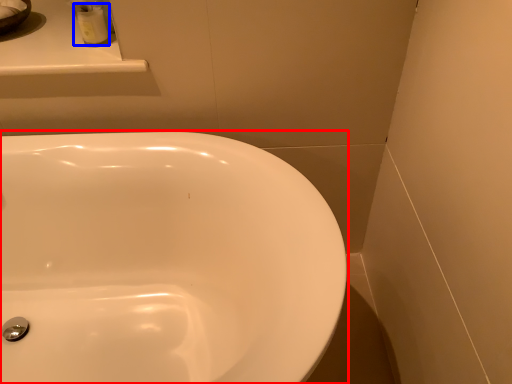
Question: Which of the following is the farthest to the observer, sink (highlighted by a red box) or toiletry (highlighted by a blue box)?

Choices:
 (A) sink
 (B) toiletry

Answer: (B)